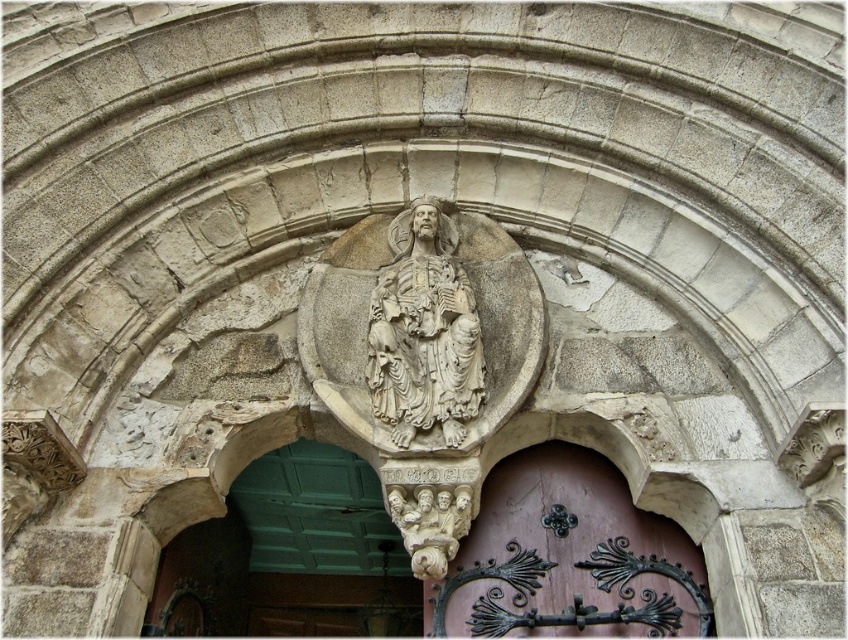
Question: Observing the image, what is the correct spatial positioning of pink wood door at center in reference to white stone statue at center?

Choices:
 (A) below
 (B) above

Answer: (A)

Question: Can you confirm if pink wood door at center is positioned to the left of white stone statue at center?

Choices:
 (A) yes
 (B) no

Answer: (B)

Question: Estimate the real-world distances between objects in this image. Which object is closer to the pink wood door at center?

Choices:
 (A) white stone statue at center
 (B) white stone carving at center

Answer: (B)

Question: Estimate the real-world distances between objects in this image. Which object is farther from the pink wood door at center?

Choices:
 (A) white stone carving at center
 (B) white stone statue at center

Answer: (B)

Question: Is white stone statue at center to the right of white stone carving at center from the viewer's perspective?

Choices:
 (A) yes
 (B) no

Answer: (B)

Question: Which of the following is the farthest from the observer?

Choices:
 (A) (439, 522)
 (B) (579, 481)

Answer: (B)